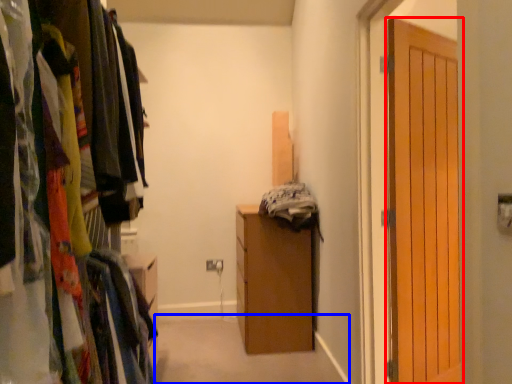
Question: Which object appears closest to the camera in this image, door (highlighted by a red box) or path (highlighted by a blue box)?

Choices:
 (A) door
 (B) path

Answer: (A)